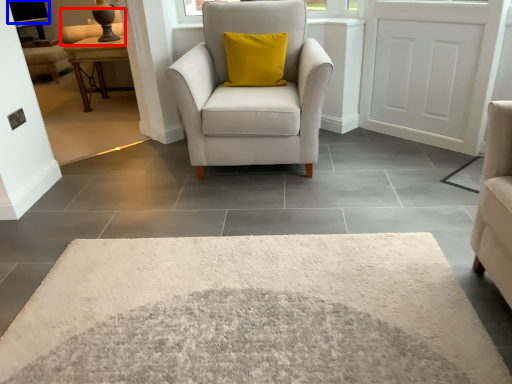
Question: Which object is further to the camera taking this photo, couch (highlighted by a red box) or window screen (highlighted by a blue box)?

Choices:
 (A) couch
 (B) window screen

Answer: (B)